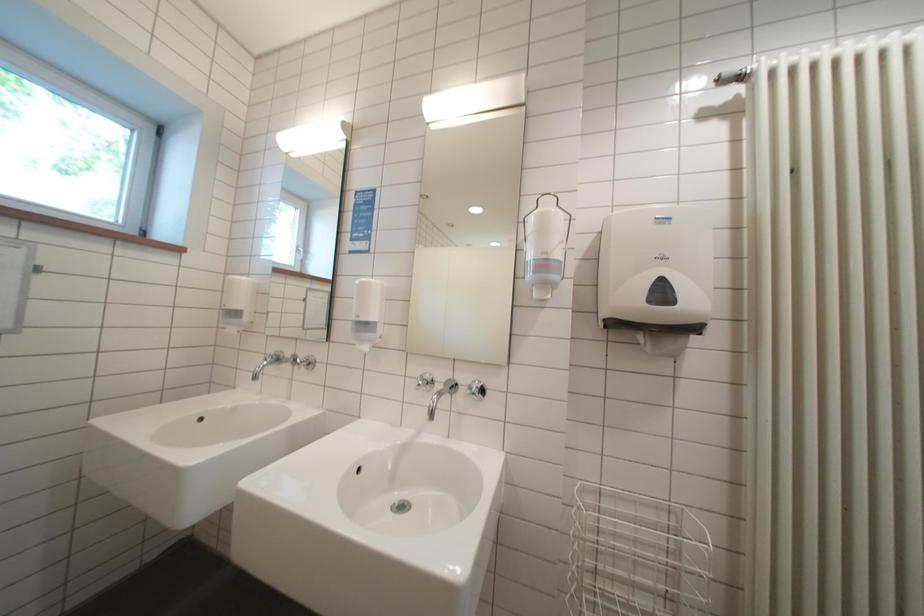
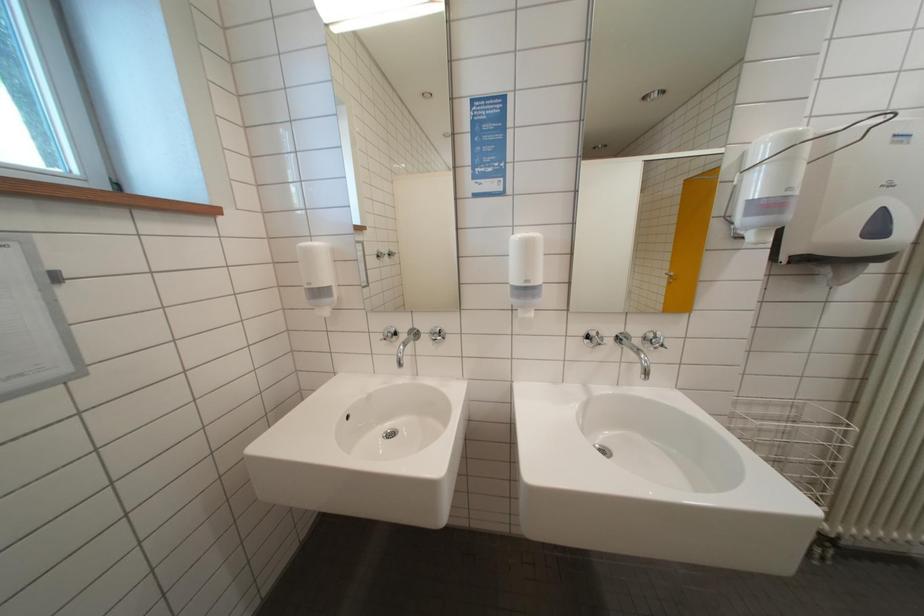
Question: The images are taken continuously from a first-person perspective. In which direction are you moving?

Choices:
 (A) Left
 (B) Right
 (C) Forward
 (D) Backward

Answer: (A)